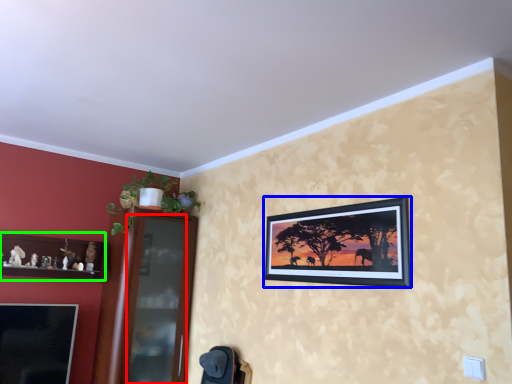
Question: Considering the real-world distances, which object is closest to glass door (highlighted by a red box)? picture frame (highlighted by a blue box) or shelf (highlighted by a green box).

Choices:
 (A) picture frame
 (B) shelf

Answer: (B)